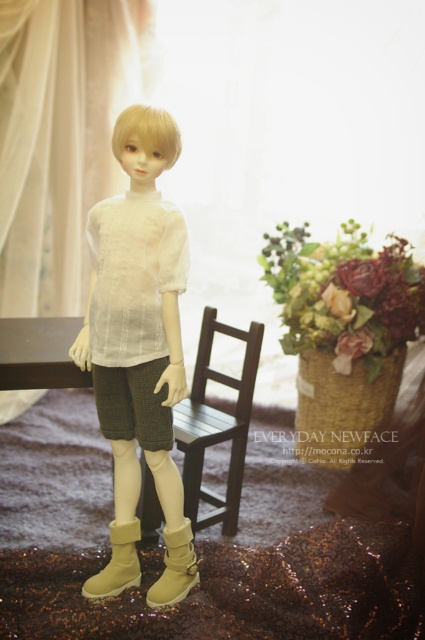
Who is shorter, woven straw basket at center or tan suede boot at lower center?

tan suede boot at lower center is shorter.

Is point (319, 385) farther from camera compared to point (190, 570)?

Yes, point (319, 385) is farther from viewer.

At what (x,y) coordinates should I click in order to perform the action: click on woven straw basket at center. Please return your answer as a coordinate pair (x, y). Image resolution: width=425 pixels, height=640 pixels. Looking at the image, I should click on (342, 404).

Between wooden chair at center and woven straw basket at center, which one appears on the right side from the viewer's perspective?

woven straw basket at center

Who is more forward, (204,486) or (354,396)?

Point (204,486) is in front.

What are the coordinates of `wooden chair at center` in the screenshot? It's located at (215, 426).

Can you confirm if dark green textured shorts at center is thinner than beige suede boot at lower center?

In fact, dark green textured shorts at center might be wider than beige suede boot at lower center.

Can you confirm if dark green textured shorts at center is taller than beige suede boot at lower center?

Indeed, dark green textured shorts at center has a greater height compared to beige suede boot at lower center.

Does point (147, 436) lie behind point (125, 570)?

No, it is not.

Find the location of a particular element. Image resolution: width=425 pixels, height=640 pixels. dark green textured shorts at center is located at coordinates (133, 403).